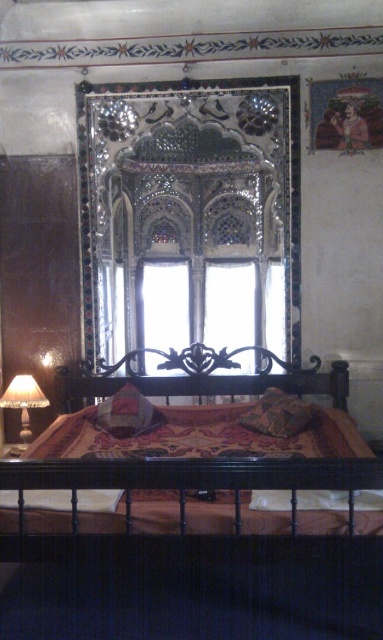
Does black wrought iron headboard at center have a greater height compared to velvet-like brown pillow at center?

Yes, black wrought iron headboard at center is taller than velvet-like brown pillow at center.

What do you see at coordinates (199, 378) in the screenshot?
I see `black wrought iron headboard at center` at bounding box center [199, 378].

This screenshot has width=383, height=640. In order to click on black wrought iron headboard at center in this screenshot , I will do `click(199, 378)`.

Does patterned fabric bedspread at center have a larger size compared to velvet-like brown pillow at center?

Indeed, patterned fabric bedspread at center has a larger size compared to velvet-like brown pillow at center.

Which of these two, patterned fabric bedspread at center or velvet-like brown pillow at center, stands taller?

velvet-like brown pillow at center is taller.

Identify the location of patterned fabric bedspread at center. (199, 436).

Does black wrought iron headboard at center appear over translucent glass lampshade at left?

Correct, black wrought iron headboard at center is located above translucent glass lampshade at left.

How much distance is there between black wrought iron headboard at center and translucent glass lampshade at left?

black wrought iron headboard at center is 24.35 inches from translucent glass lampshade at left.

At what (x,y) coordinates should I click in order to perform the action: click on black wrought iron headboard at center. Please return your answer as a coordinate pair (x, y). This screenshot has height=640, width=383. Looking at the image, I should click on (x=199, y=378).